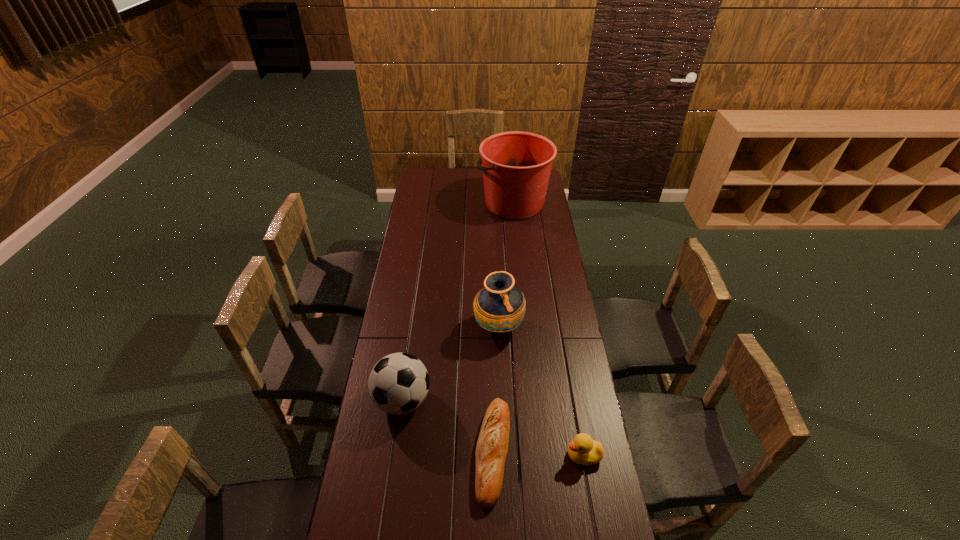
Find the location of `free space located on the right of the third tallest object`. free space located on the right of the third tallest object is located at coordinates (456, 400).

Where is `free space located 0.370m at the beak of the fourth tallest object`? The image size is (960, 540). free space located 0.370m at the beak of the fourth tallest object is located at coordinates (x=453, y=455).

Locate an element on the screen. The width and height of the screenshot is (960, 540). vacant space located at the beak of the fourth tallest object is located at coordinates (540, 455).

The height and width of the screenshot is (540, 960). Find the location of `free region located at the beak of the fourth tallest object`. free region located at the beak of the fourth tallest object is located at coordinates 453,455.

This screenshot has height=540, width=960. Find the location of `vacant space located on the left of the baguet`. vacant space located on the left of the baguet is located at coordinates (461, 451).

Identify the location of object present at the far edge. (516, 165).

In order to click on object located at the left edge in this screenshot , I will do `click(398, 383)`.

The image size is (960, 540). I want to click on bucket at the right edge, so click(x=516, y=165).

Image resolution: width=960 pixels, height=540 pixels. Find the location of `duck situated at the right edge`. duck situated at the right edge is located at coordinates (583, 450).

The image size is (960, 540). In order to click on object that is at the far right corner in this screenshot , I will do `click(516, 165)`.